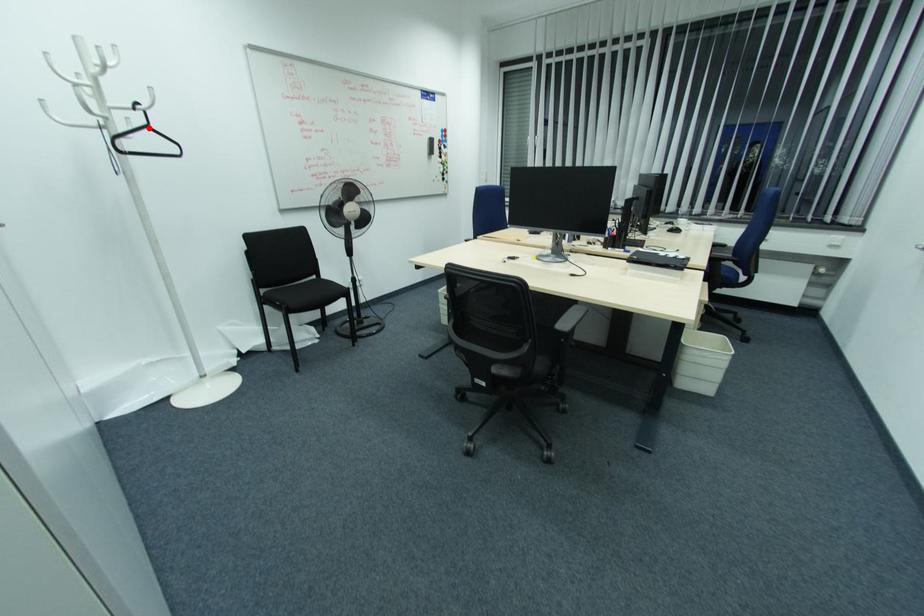
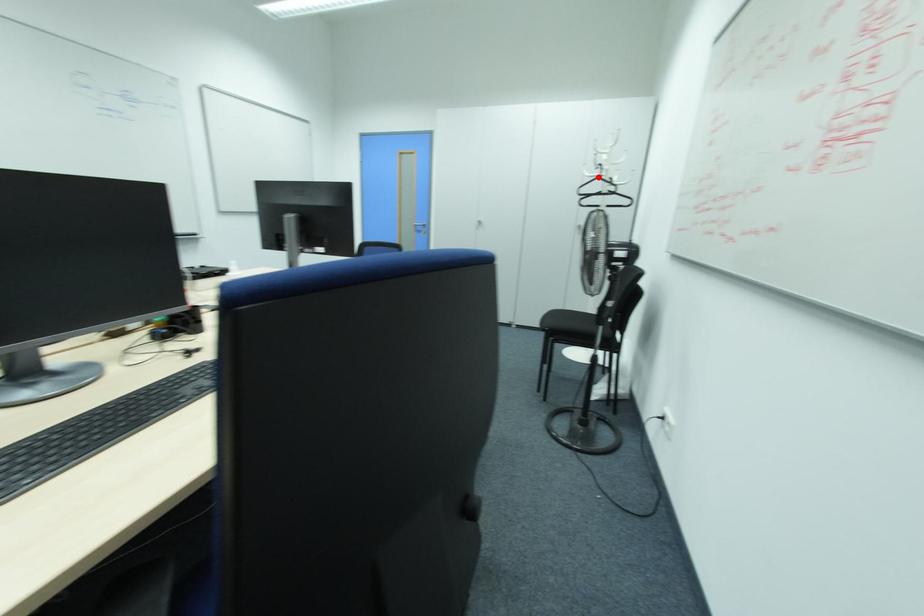
I am providing you with two images of the same scene from different viewpoints. A red point is marked on the first image and another point is marked on the second image. Are the points marked in image1 and image2 representing the same 3D position?

Yes